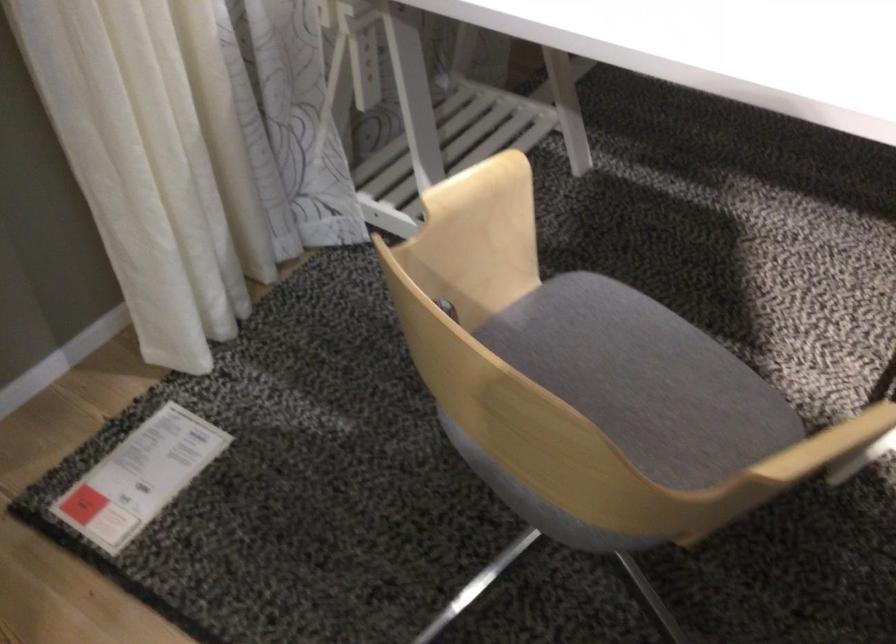
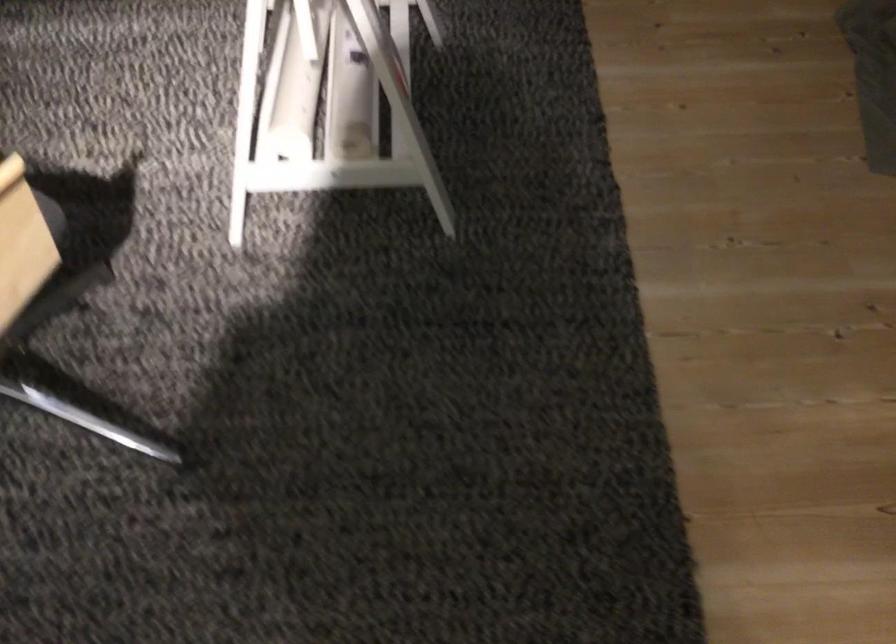
Question: How did the camera likely rotate?

Choices:
 (A) Left
 (B) Right
 (C) Up
 (D) Down

Answer: (B)